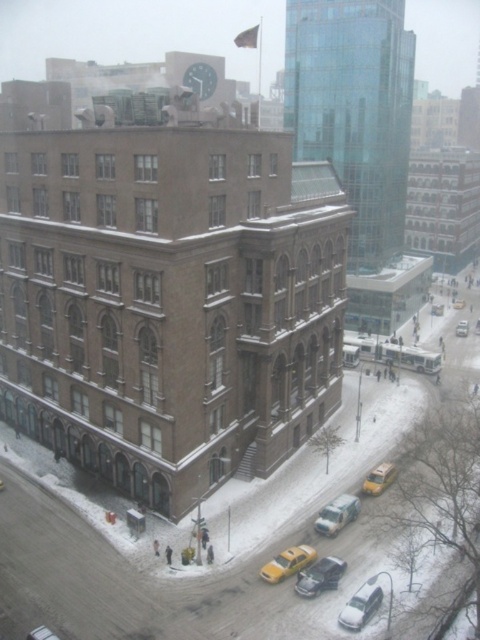
Question: Does yellow matte taxi at lower center lie behind yellow matte taxi cab at center?

Choices:
 (A) yes
 (B) no

Answer: (B)

Question: Among these objects, which one is farthest from the camera?

Choices:
 (A) white glossy car at lower right
 (B) metallic silver car at lower left

Answer: (A)

Question: Which point is farther to the camera?

Choices:
 (A) (456, 328)
 (B) (372, 596)
 (C) (32, 634)
 (D) (297, 554)

Answer: (A)

Question: Which point is farther to the camera?

Choices:
 (A) yellow matte taxi at lower center
 (B) white glossy car at lower right

Answer: (A)

Question: Is yellow matte taxi at lower center above yellow matte taxi at lower right?

Choices:
 (A) no
 (B) yes

Answer: (A)

Question: Does white glossy car at lower right have a larger size compared to metallic silver car at lower left?

Choices:
 (A) no
 (B) yes

Answer: (B)